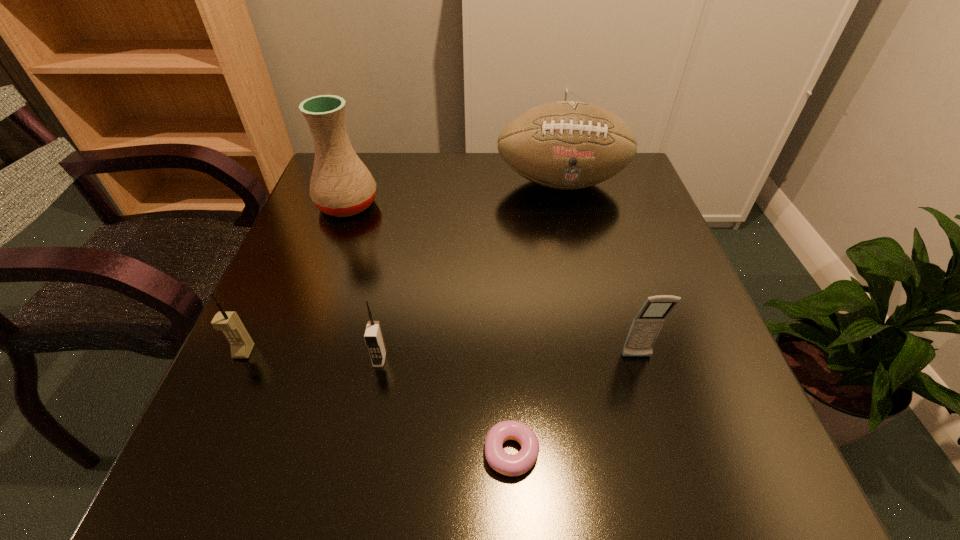
The image size is (960, 540). I want to click on free space located 0.090m on the front of the leftmost cellular telephone, where the keypad is located, so click(x=219, y=407).

You are a GUI agent. You are given a task and a screenshot of the screen. Output one action in this format:
    pyautogui.click(x=<x>, y=<y>)
    Task: Click on the vacant space situated on the front-facing side of the fourth object from right to left
    
    Given the screenshot: What is the action you would take?
    pyautogui.click(x=367, y=428)

The image size is (960, 540). In order to click on vacant space located on the left of the shortest object in this screenshot , I will do `click(377, 452)`.

Locate an element on the screen. This screenshot has height=540, width=960. pottery that is at the far edge is located at coordinates (341, 185).

Identify the location of football (American) that is positioned at the far edge. The image size is (960, 540). (566, 145).

Find the location of a particular element. object positioned at the near edge is located at coordinates (517, 464).

At what (x,y) coordinates should I click in order to perform the action: click on pottery that is at the left edge. Please return your answer as a coordinate pair (x, y). The height and width of the screenshot is (540, 960). Looking at the image, I should click on (341, 185).

This screenshot has height=540, width=960. I want to click on cellular telephone at the left edge, so click(241, 344).

This screenshot has height=540, width=960. In order to click on football (American) at the right edge in this screenshot , I will do `click(566, 145)`.

The image size is (960, 540). Identify the location of cellular telephone that is at the right edge. (646, 325).